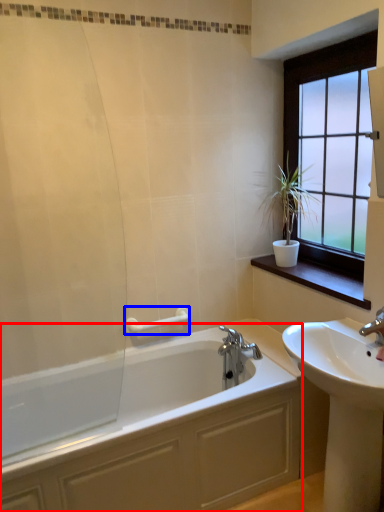
Question: Which point is closer to the camera, bathtub (highlighted by a red box) or towel bar (highlighted by a blue box)?

Choices:
 (A) bathtub
 (B) towel bar

Answer: (A)